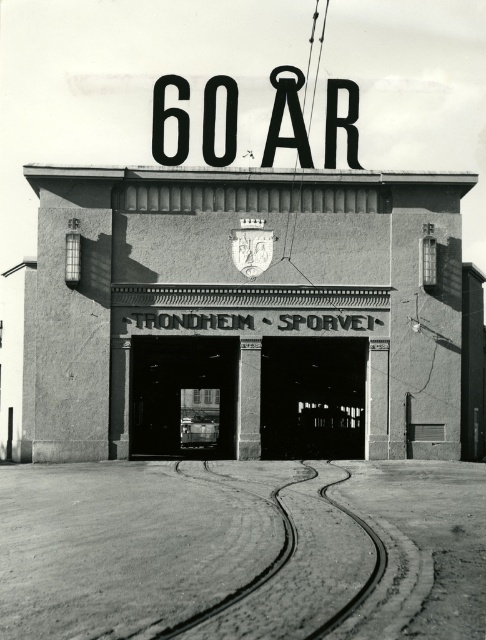
Question: Is concrete textured building at center thinner than black metal sign at upper center?

Choices:
 (A) yes
 (B) no

Answer: (B)

Question: Where is concrete textured building at center located in relation to black metal sign at upper center in the image?

Choices:
 (A) below
 (B) above

Answer: (A)

Question: Does concrete textured building at center have a lesser width compared to black metal sign at upper center?

Choices:
 (A) no
 (B) yes

Answer: (A)

Question: Among these objects, which one is nearest to the camera?

Choices:
 (A) black metal sign at upper center
 (B) concrete textured building at center

Answer: (B)